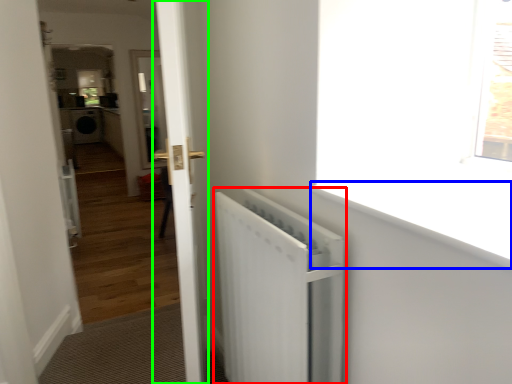
Question: Which object is positioned farthest from radiator (highlighted by a red box)? Select from window sill (highlighted by a blue box) and door (highlighted by a green box).

Choices:
 (A) window sill
 (B) door

Answer: (A)